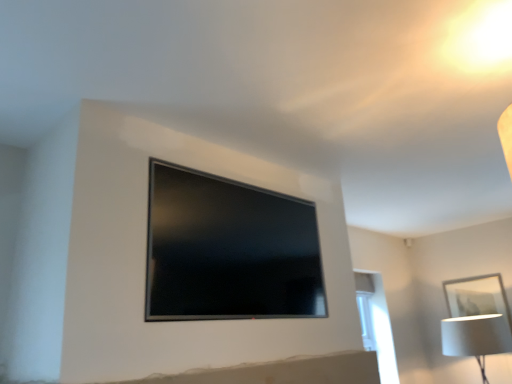
Measure the distance between point (490, 308) and camera.

A distance of 14.60 feet exists between point (490, 308) and camera.

Describe the element at coordinates (477, 297) in the screenshot. Image resolution: width=512 pixels, height=384 pixels. I see `white matte picture frame at lower right` at that location.

What is the approximate width of white glossy window at right?

It is 28.62 centimeters.

Describe the element at coordinates (476, 337) in the screenshot. I see `white fabric lampshade at lower right` at that location.

The height and width of the screenshot is (384, 512). Identify the location of matte black tv at center. (229, 250).

Is the position of matte black tv at center less distant than that of white glossy window at right?

Yes, matte black tv at center is closer to the viewer.

Can we say matte black tv at center lies outside white glossy window at right?

Yes, matte black tv at center is not within white glossy window at right.

Considering the relative positions of matte black tv at center and white glossy window at right in the image provided, is matte black tv at center to the left of white glossy window at right from the viewer's perspective?

Yes.

From a real-world perspective, which object stands above the other?

In real-world perspective, matte black tv at center is above.

Is white fabric lampshade at lower right to the left of matte black tv at center from the viewer's perspective?

No, white fabric lampshade at lower right is not to the left of matte black tv at center.

This screenshot has width=512, height=384. Identify the location of lamp on the right of matte black tv at center. (476, 337).

From the picture: Which object is wider, white fabric lampshade at lower right or matte black tv at center?

With larger width is white fabric lampshade at lower right.

In the scene shown: Is matte black tv at center wider than white fabric lampshade at lower right?

In fact, matte black tv at center might be narrower than white fabric lampshade at lower right.

Measure the distance from matte black tv at center to white fabric lampshade at lower right.

A distance of 7.86 feet exists between matte black tv at center and white fabric lampshade at lower right.

Locate an element on the screen. This screenshot has height=384, width=512. lamp to the right of matte black tv at center is located at coordinates (476, 337).

Which of these two, matte black tv at center or white fabric lampshade at lower right, stands shorter?

Standing shorter between the two is white fabric lampshade at lower right.

From a real-world perspective, who is located lower, white fabric lampshade at lower right or white glossy window at right?

In real-world perspective, white fabric lampshade at lower right is lower.

Which is more to the left, white fabric lampshade at lower right or white glossy window at right?

Positioned to the left is white glossy window at right.

Is white fabric lampshade at lower right looking in the opposite direction of white glossy window at right?

No, white fabric lampshade at lower right is not facing the opposite direction of white glossy window at right.

Locate an element on the screen. lamp in front of the white glossy window at right is located at coordinates (476, 337).

Is the depth of white glossy window at right greater than that of white fabric lampshade at lower right?

Yes, it is.

Is white glossy window at right oriented away from white fabric lampshade at lower right?

white glossy window at right is not turned away from white fabric lampshade at lower right.

Can you confirm if white glossy window at right is bigger than white fabric lampshade at lower right?

No.

Could white fabric lampshade at lower right be considered to be inside white glossy window at right?

No, white fabric lampshade at lower right is located outside of white glossy window at right.

Measure the distance from matte black tv at center to white matte picture frame at lower right.

3.14 meters.

From the image's perspective, between matte black tv at center and white matte picture frame at lower right, which one is located above?

matte black tv at center appears higher in the image.

Is matte black tv at center further to camera compared to white matte picture frame at lower right?

No, matte black tv at center is closer to the viewer.

Is white matte picture frame at lower right next to white glossy window at right and touching it?

No, white matte picture frame at lower right is not touching white glossy window at right.

In the image, is white matte picture frame at lower right positioned in front of or behind white glossy window at right?

white matte picture frame at lower right is positioned farther from the viewer than white glossy window at right.

Between white matte picture frame at lower right and white glossy window at right, which one has more height?

white glossy window at right.

Does point (505, 317) come in front of point (385, 316)?

Yes, it is.

I want to click on television above the white glossy window at right (from a real-world perspective), so coord(229,250).

At what (x,y) coordinates should I click in order to perform the action: click on lamp beneath the matte black tv at center (from a real-world perspective). Please return your answer as a coordinate pair (x, y). This screenshot has width=512, height=384. Looking at the image, I should click on (476, 337).

Considering their positions, is white fabric lampshade at lower right positioned closer to matte black tv at center than white glossy window at right?

white glossy window at right.

In the scene shown: Which object lies further to the anchor point white matte picture frame at lower right, white fabric lampshade at lower right or matte black tv at center?

Based on the image, matte black tv at center appears to be further to white matte picture frame at lower right.

When comparing their distances from white matte picture frame at lower right, does matte black tv at center or white fabric lampshade at lower right seem further?

Among the two, matte black tv at center is located further to white matte picture frame at lower right.

From the image, which object appears to be nearer to white matte picture frame at lower right, matte black tv at center or white glossy window at right?

white glossy window at right is closer to white matte picture frame at lower right.

Looking at the image, which one is located further to matte black tv at center, white glossy window at right or white matte picture frame at lower right?

white matte picture frame at lower right lies further to matte black tv at center than the other object.

Estimate the real-world distances between objects in this image. Which object is further from white glossy window at right, matte black tv at center or white matte picture frame at lower right?

matte black tv at center is further to white glossy window at right.

When comparing their distances from matte black tv at center, does white glossy window at right or white fabric lampshade at lower right seem closer?

white glossy window at right is closer to matte black tv at center.

Based on the photo, considering their positions, is white matte picture frame at lower right positioned closer to matte black tv at center than white glossy window at right?

white glossy window at right lies closer to matte black tv at center than the other object.

You are a GUI agent. You are given a task and a screenshot of the screen. Output one action in this format:
    pyautogui.click(x=<x>, y=<y>)
    Task: Click on the window between matte black tv at center and white matte picture frame at lower right along the z-axis
    This screenshot has width=512, height=384.
    Given the screenshot: What is the action you would take?
    pyautogui.click(x=376, y=323)

Identify the location of lamp located between matte black tv at center and white matte picture frame at lower right in the left-right direction. This screenshot has height=384, width=512. (476, 337).

Image resolution: width=512 pixels, height=384 pixels. I want to click on lamp between white glossy window at right and white matte picture frame at lower right in the horizontal direction, so click(476, 337).

At what (x,y) coordinates should I click in order to perform the action: click on lamp between matte black tv at center and white glossy window at right along the z-axis. Please return your answer as a coordinate pair (x, y). Image resolution: width=512 pixels, height=384 pixels. Looking at the image, I should click on (476, 337).